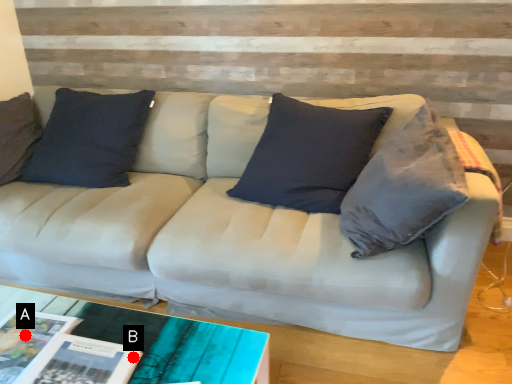
Question: Two points are circled on the image, labeled by A and B beside each circle. Which point appears closest to the camera in this image?

Choices:
 (A) A is closer
 (B) B is closer

Answer: (B)